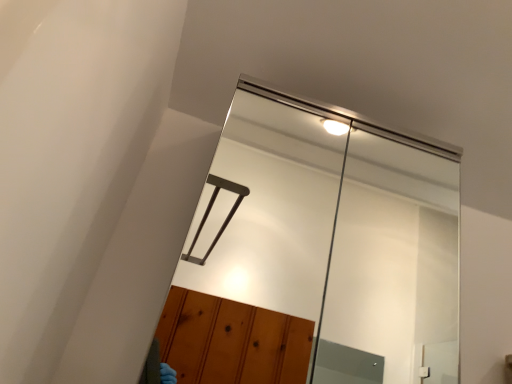
You are a GUI agent. You are given a task and a screenshot of the screen. Output one action in this format:
    pyautogui.click(x=<x>, y=<y>)
    Task: Click on the transparent glass door at upper center
    The image size is (512, 384).
    Given the screenshot: What is the action you would take?
    pyautogui.click(x=317, y=254)

The height and width of the screenshot is (384, 512). What do you see at coordinates (317, 254) in the screenshot?
I see `transparent glass door at upper center` at bounding box center [317, 254].

The image size is (512, 384). I want to click on transparent glass door at upper center, so click(317, 254).